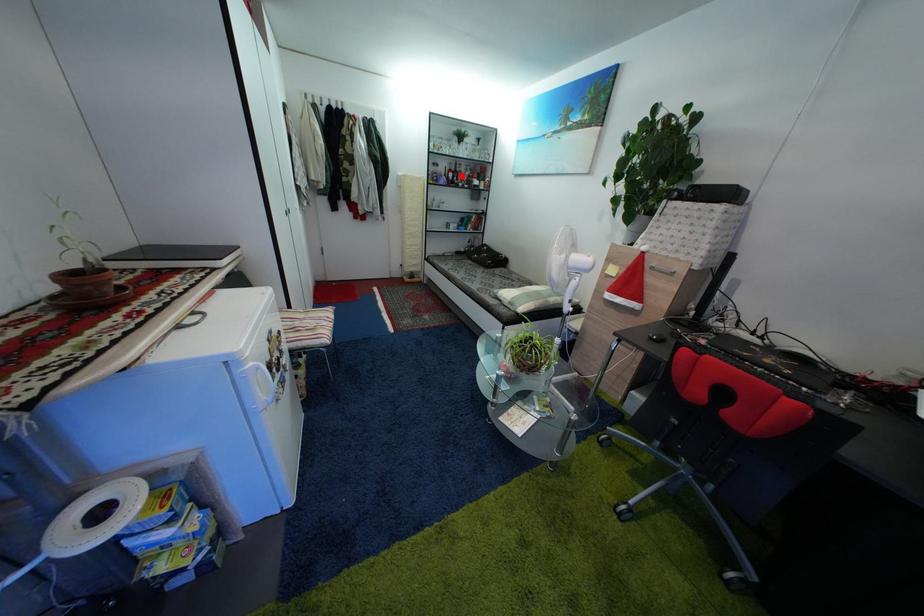
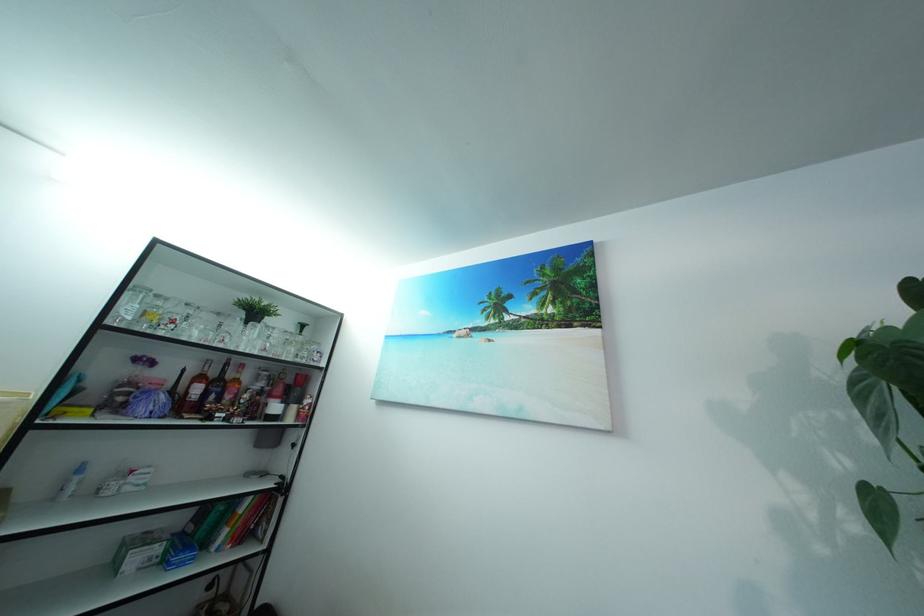
In the second image, find the point that corresponds to the highlighted location in the first image.

(222, 381)